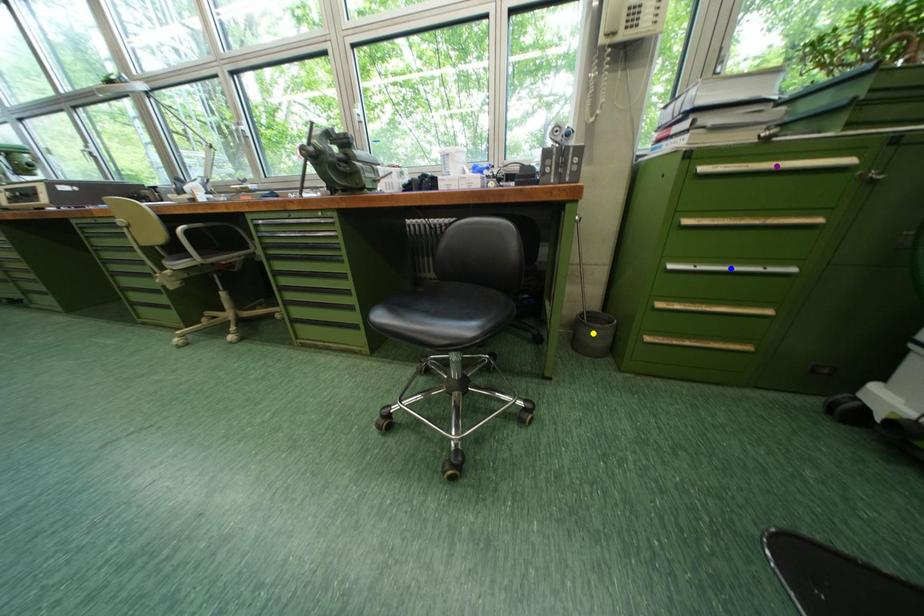
From the picture: Order these from nearest to farthest:
- blue point
- purple point
- yellow point

yellow point, blue point, purple point